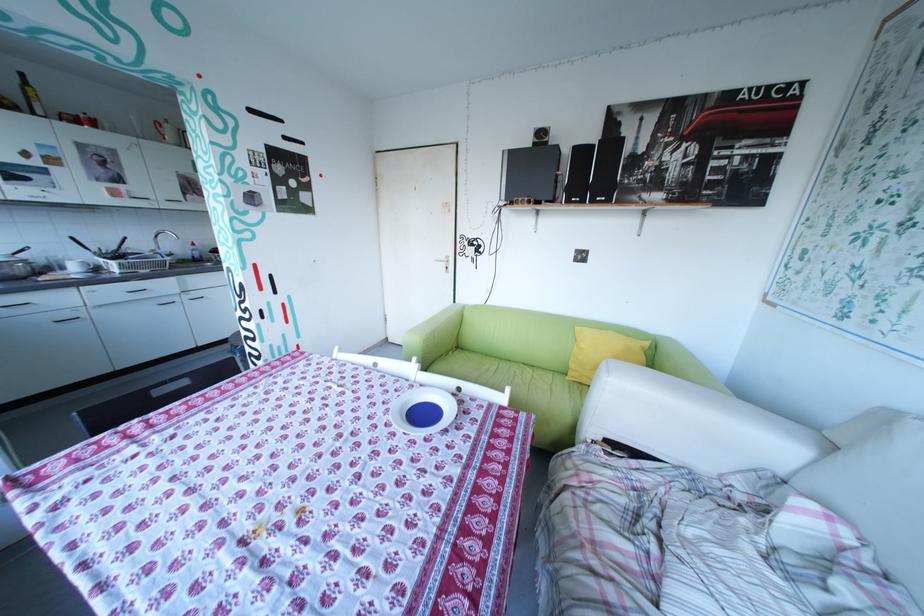
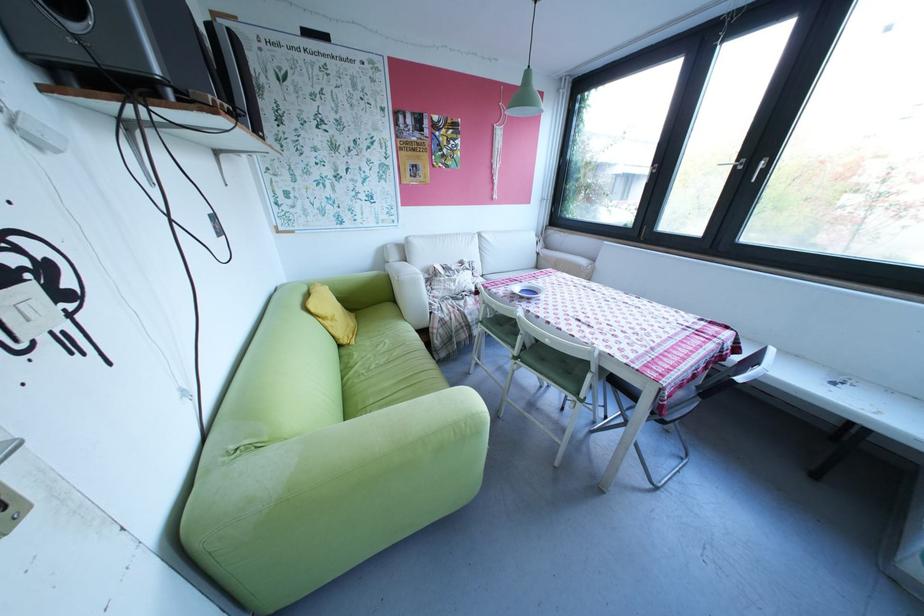
Where in the second image is the point corresponding to point (579, 378) from the first image?

(366, 342)